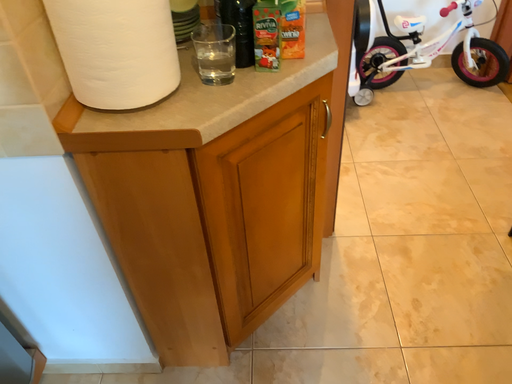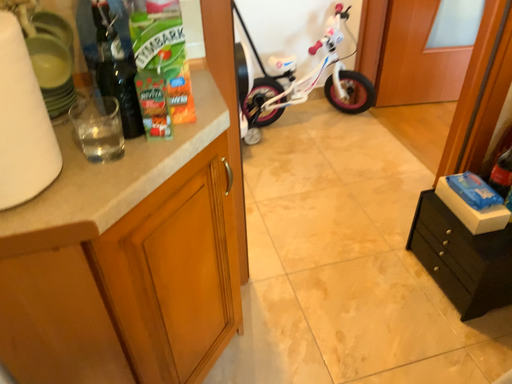
Question: How did the camera likely rotate when shooting the video?

Choices:
 (A) rotated right
 (B) rotated left

Answer: (A)